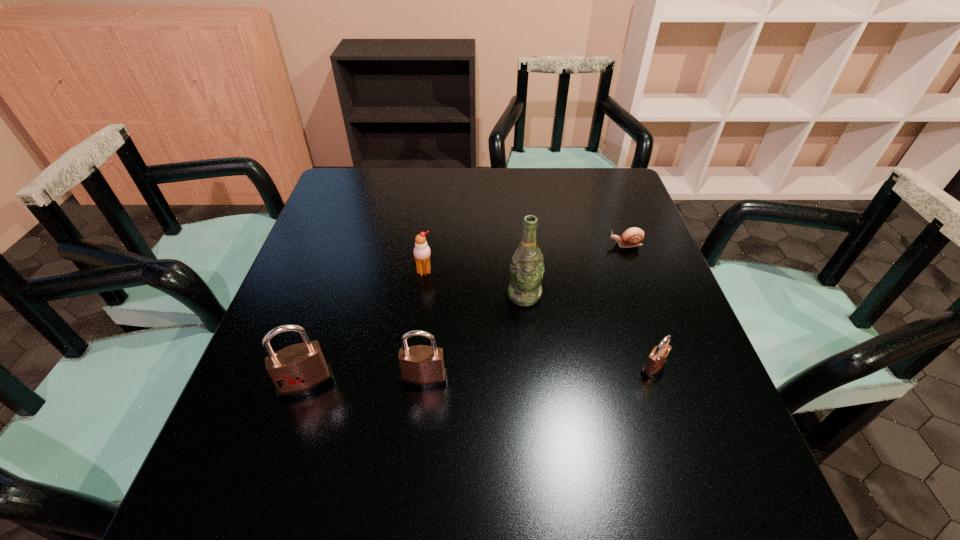
Where is `the farthest object`? The width and height of the screenshot is (960, 540). the farthest object is located at coordinates point(632,237).

Locate an element on the screen. The height and width of the screenshot is (540, 960). free space located on the left of the leftmost object is located at coordinates (249, 384).

Locate an element on the screen. The width and height of the screenshot is (960, 540). vacant position located on the back of the second padlock from right to left is located at coordinates (434, 286).

Locate an element on the screen. blank space located 0.120m on the left of the shortest padlock is located at coordinates (581, 368).

Find the location of a particular element. The width and height of the screenshot is (960, 540). vacant space located at the front with a straw on the fourth tallest object is located at coordinates (415, 346).

The image size is (960, 540). What are the coordinates of `blank space located on the surface of the fourth object from left to right` in the screenshot? It's located at (534, 388).

The height and width of the screenshot is (540, 960). I want to click on free point located 0.130m on the front-facing side of the escargot, so click(x=561, y=245).

This screenshot has width=960, height=540. What are the coordinates of `blank space located on the front-facing side of the escargot` in the screenshot? It's located at (512, 245).

At what (x,y) coordinates should I click in order to perform the action: click on blank area located on the front-facing side of the escargot. Please return your answer as a coordinate pair (x, y). The image size is (960, 540). Looking at the image, I should click on (497, 245).

I want to click on object that is at the left edge, so click(298, 370).